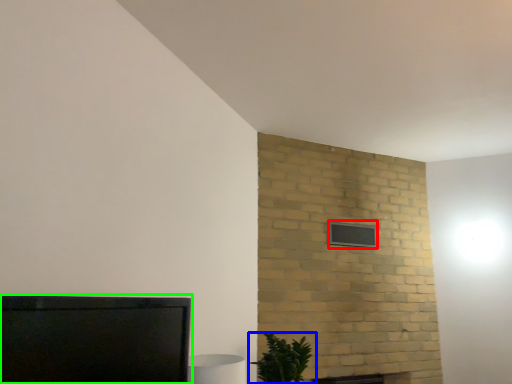
Question: Estimate the real-world distances between objects in this image. Which object is farther from window (highlighted by a red box), houseplant (highlighted by a blue box) or furniture (highlighted by a green box)?

Choices:
 (A) houseplant
 (B) furniture

Answer: (B)